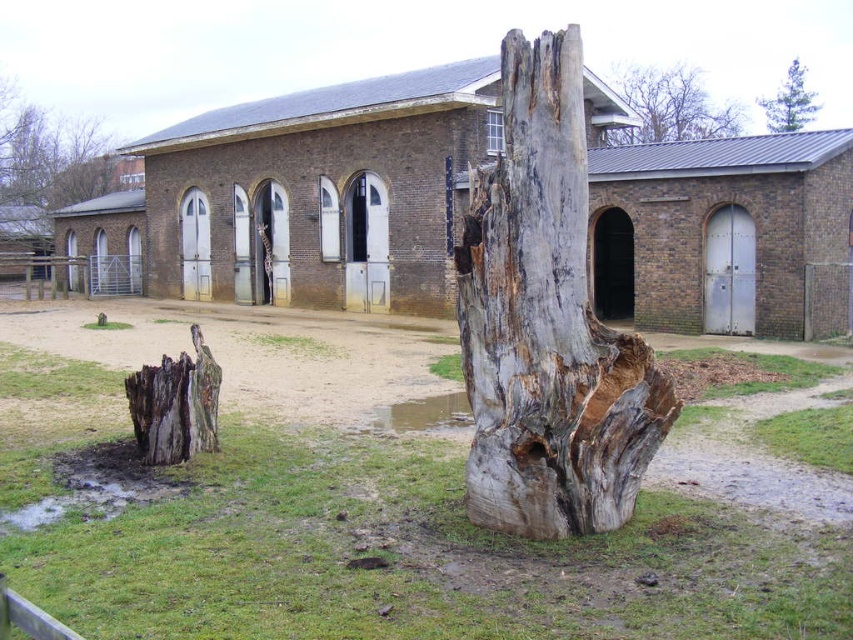
Question: Does rough bark stump at lower left appear on the left side of gray rough bark tree stump at upper center?

Choices:
 (A) yes
 (B) no

Answer: (A)

Question: Among these points, which one is nearest to the camera?

Choices:
 (A) [25, 163]
 (B) [695, 132]
 (C) [322, 115]

Answer: (C)

Question: Among these points, which one is nearest to the camera?

Choices:
 (A) (779, 109)
 (B) (200, 394)
 (C) (726, 116)

Answer: (B)

Question: Does weathered wood tree trunk at center have a larger size compared to gray rough bark tree stump at upper center?

Choices:
 (A) yes
 (B) no

Answer: (B)

Question: Does rough bark stump at lower left have a greater width compared to gray rough bark tree stump at upper center?

Choices:
 (A) no
 (B) yes

Answer: (A)

Question: Which of the following is the closest to the observer?

Choices:
 (A) green textured pine tree at upper right
 (B) brown rough tree stump at upper left
 (C) brown brick building at center

Answer: (C)